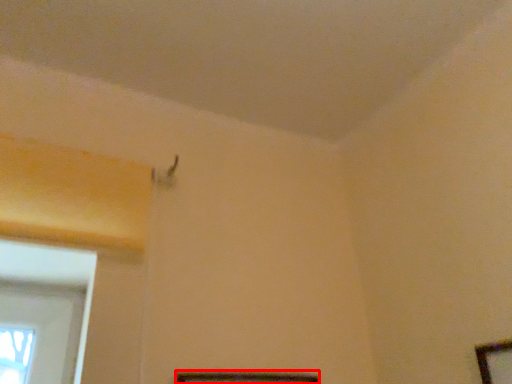
Question: From the image's perspective, what is the correct spatial positioning of picture frame (annotated by the red box) in reference to picture frame?

Choices:
 (A) above
 (B) below

Answer: (B)